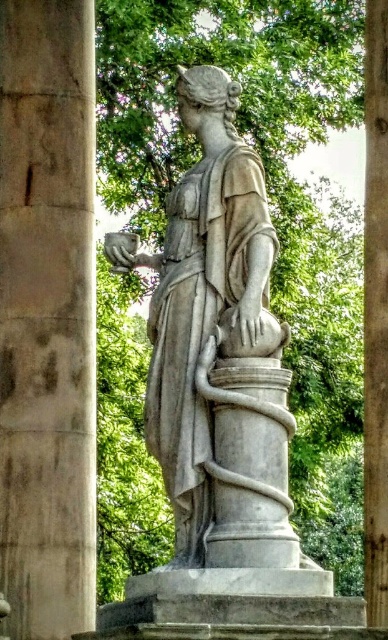
Question: Which point is farther to the camera?

Choices:
 (A) smooth stone column at left
 (B) brown wood post at right
 (C) white marble statue at center

Answer: (A)

Question: Considering the real-world distances, which object is farthest from the smooth stone column at left?

Choices:
 (A) white marble statue at center
 (B) brown wood post at right

Answer: (B)

Question: Can you confirm if smooth stone column at left is positioned above brown wood post at right?

Choices:
 (A) yes
 (B) no

Answer: (A)

Question: Which object is farther from the camera taking this photo?

Choices:
 (A) white marble statue at center
 (B) brown wood post at right

Answer: (B)

Question: Is smooth stone column at left smaller than brown wood post at right?

Choices:
 (A) yes
 (B) no

Answer: (A)

Question: Can you confirm if smooth stone column at left is wider than white marble statue at center?

Choices:
 (A) yes
 (B) no

Answer: (B)